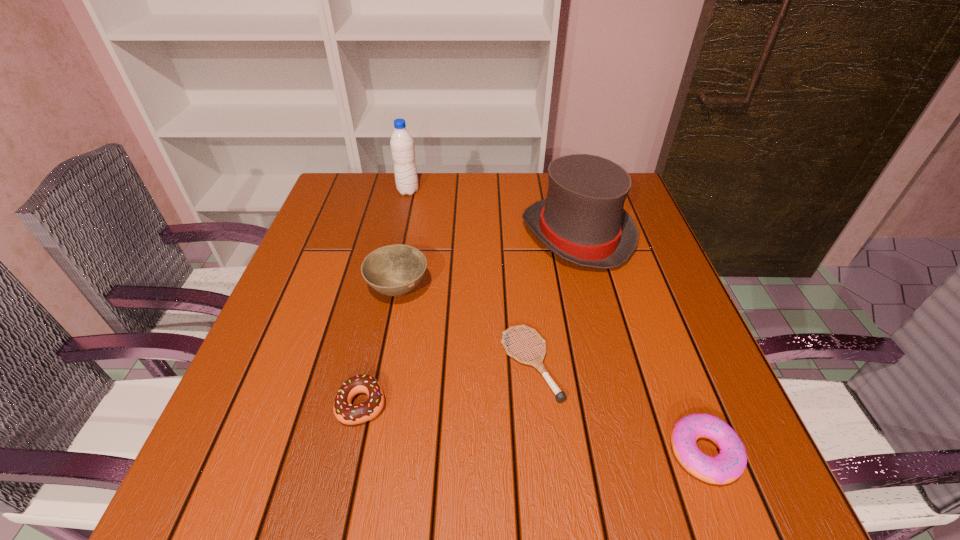
You are a GUI agent. You are given a task and a screenshot of the screen. Output one action in this format:
    pyautogui.click(x=<x>, y=<y>)
    Task: Click on the vacant region located 0.250m on the back of the left doughnut
    
    Given the screenshot: What is the action you would take?
    pyautogui.click(x=388, y=287)

Where is `vacant space located on the left of the right doughnut`? This screenshot has height=540, width=960. vacant space located on the left of the right doughnut is located at coordinates (491, 453).

This screenshot has height=540, width=960. In order to click on vacant area situated 0.250m on the right of the shortest object in this screenshot , I will do `click(691, 363)`.

The image size is (960, 540). Find the location of `water bottle located at the far edge`. water bottle located at the far edge is located at coordinates (402, 144).

Identify the location of dress hat located at the far edge. This screenshot has width=960, height=540. (582, 220).

The image size is (960, 540). Find the location of `object located at the near edge`. object located at the near edge is located at coordinates tap(726, 467).

Find the location of a particular element. The image size is (960, 540). dress hat that is positioned at the right edge is located at coordinates (582, 220).

Where is `doughnut at the right edge`? The width and height of the screenshot is (960, 540). doughnut at the right edge is located at coordinates (726, 467).

At what (x,y) coordinates should I click in order to perform the action: click on object present at the far right corner. Please return your answer as a coordinate pair (x, y). Image resolution: width=960 pixels, height=540 pixels. Looking at the image, I should click on point(582,220).

Locate an element on the screen. The width and height of the screenshot is (960, 540). object present at the near right corner is located at coordinates (726, 467).